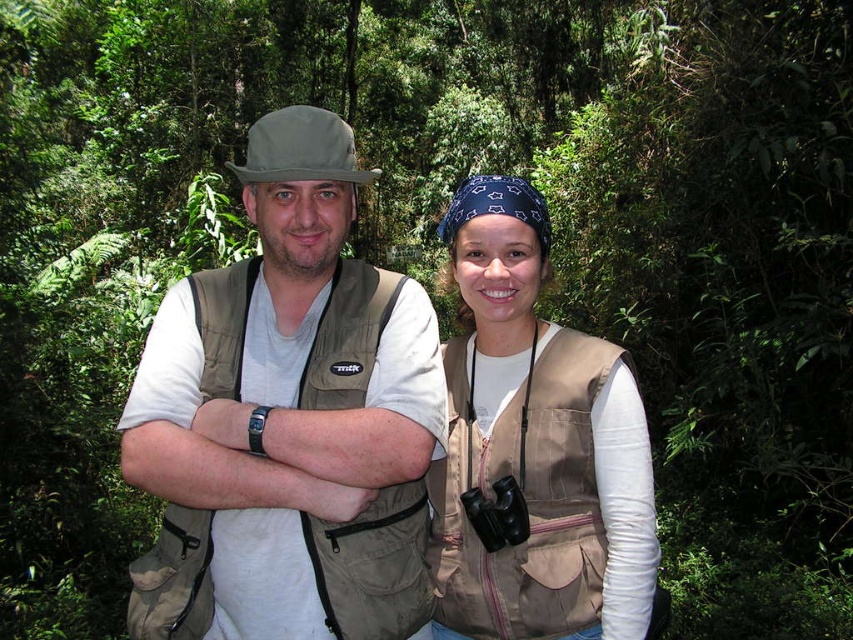
Is khaki fabric hat at center bigger than tan canvas vest at center?

Yes.

Locate an element on the screen. This screenshot has width=853, height=640. khaki fabric hat at center is located at coordinates (288, 419).